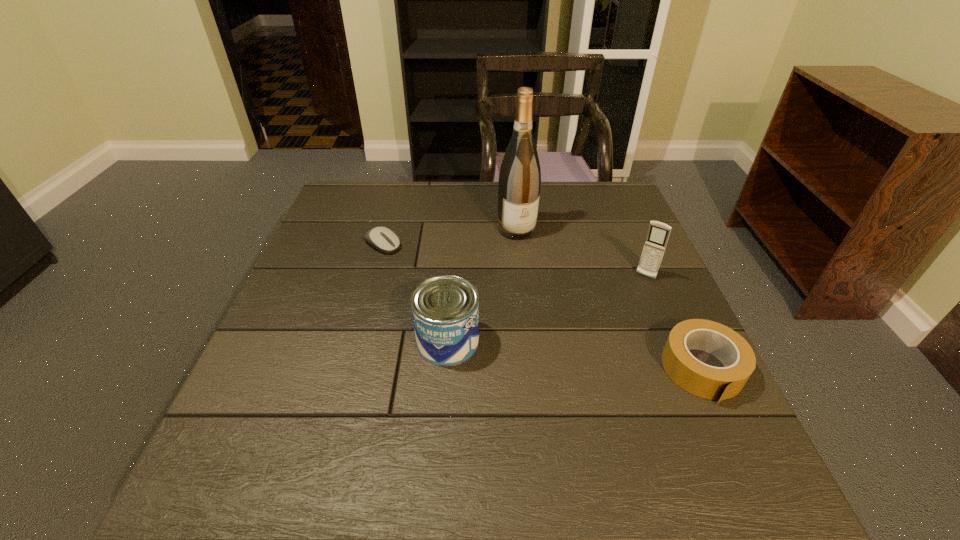
You are a GUI agent. You are given a task and a screenshot of the screen. Output one action in this format:
    pyautogui.click(x=<x>, y=<y>)
    Task: Click on the free space on the desktop that is between the can and the duct tape and is positioned on the front-facing side of the third nearest object
    The width and height of the screenshot is (960, 540).
    Given the screenshot: What is the action you would take?
    pyautogui.click(x=597, y=358)

This screenshot has height=540, width=960. I want to click on vacant space on the desktop that is between the second object from left to right and the fourth tallest object and is positioned on the label of the wine bottle, so click(x=589, y=357).

Identify the location of vacant space on the desktop that is between the can and the fourth tallest object and is positioned on the wheel side of the shortest object. The width and height of the screenshot is (960, 540). (567, 355).